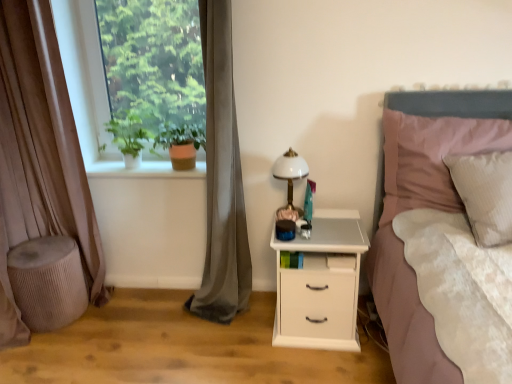
Measure the distance between green matte plant at upper left, the second plant positioned from the left, and camera.

They are 8.23 feet apart.

In order to face brown velvet curtain at left, the 2th curtain when ordered from right to left, should I rotate leftwards or rightwards?

It's best to rotate left around 26.371 degrees.

What do you see at coordinates (180, 143) in the screenshot? This screenshot has width=512, height=384. I see `green matte plant at upper left, positioned as the 2th plant in right-to-left order` at bounding box center [180, 143].

Where is `white glossy bedside lamp at center-right`? The height and width of the screenshot is (384, 512). white glossy bedside lamp at center-right is located at coordinates (290, 181).

Locate an element on the screen. Image resolution: width=512 pixels, height=384 pixels. nightstand below the brown velvet curtain at left, the 2th curtain when ordered from right to left (from the image's perspective) is located at coordinates (321, 284).

Consider the image. Does white matte nightstand at lower right have a lesser height compared to brown velvet curtain at left, which ranks as the 1th curtain in left-to-right order?

Correct, white matte nightstand at lower right is not as tall as brown velvet curtain at left, which ranks as the 1th curtain in left-to-right order.

Is white matte nightstand at lower right aimed at brown velvet curtain at left, the 2th curtain when ordered from right to left?

No, white matte nightstand at lower right does not turn towards brown velvet curtain at left, the 2th curtain when ordered from right to left.

Would you say white matte nightstand at lower right contains brown velvet curtain at left, which ranks as the 1th curtain in left-to-right order?

No, brown velvet curtain at left, which ranks as the 1th curtain in left-to-right order, is not a part of white matte nightstand at lower right.

Consider the image. From a real-world perspective, between green leafy plant at left and textured beige stool at lower left, who is vertically higher?

In real-world perspective, green leafy plant at left is above.

Consider the image. Which of these two, green leafy plant at left or textured beige stool at lower left, stands taller?

Standing taller between the two is green leafy plant at left.

Locate an element on the screen. This screenshot has width=512, height=384. window that appears on the right of textured beige stool at lower left is located at coordinates [x=140, y=63].

Between point (78, 11) and point (40, 318), which one is positioned in front?

Positioned in front is point (40, 318).

Measure the distance between white matte nightstand at lower right and smooth white surface at center left.

white matte nightstand at lower right is 92.68 centimeters away from smooth white surface at center left.

Looking at this image, which object is further away from the camera taking this photo, white matte nightstand at lower right or smooth white surface at center left?

smooth white surface at center left is further from the camera.

Between white matte nightstand at lower right and smooth white surface at center left, which one appears on the left side from the viewer's perspective?

From the viewer's perspective, smooth white surface at center left appears more on the left side.

Considering the positions of points (281, 250) and (120, 172), is point (281, 250) closer to camera compared to point (120, 172)?

Yes, point (281, 250) is closer to viewer.

Which object is more forward, green leafy plant at left or gray velvet curtain at left, the first curtain in the right-to-left sequence?

gray velvet curtain at left, the first curtain in the right-to-left sequence, is closer to the camera.

In the scene shown: Does green leafy plant at left appear on the right side of gray velvet curtain at left, positioned as the second curtain in left-to-right order?

No, green leafy plant at left is not to the right of gray velvet curtain at left, positioned as the second curtain in left-to-right order.

Is green leafy plant at left placed right next to gray velvet curtain at left, the first curtain in the right-to-left sequence?

No, green leafy plant at left is not beside gray velvet curtain at left, the first curtain in the right-to-left sequence.

Which of these two, green leafy plant at left or gray velvet curtain at left, the first curtain in the right-to-left sequence, is thinner?

Thinner between the two is green leafy plant at left.

Is green matte plant at upper left, positioned as the 2th plant in right-to-left order, far away from brown velvet curtain at left, which ranks as the 1th curtain in left-to-right order?

No, green matte plant at upper left, positioned as the 2th plant in right-to-left order, is not far from brown velvet curtain at left, which ranks as the 1th curtain in left-to-right order.

From the image's perspective, relative to brown velvet curtain at left, which ranks as the 1th curtain in left-to-right order, is green matte plant at upper left, positioned as the 1th plant in left-to-right order, above or below?

Clearly, from the image's perspective, green matte plant at upper left, positioned as the 1th plant in left-to-right order, is above brown velvet curtain at left, which ranks as the 1th curtain in left-to-right order.

Is point (125, 136) farther from camera compared to point (42, 230)?

No, it is in front of (42, 230).

Which of these two, green matte plant at upper left, positioned as the 1th plant in left-to-right order, or brown velvet curtain at left, which ranks as the 1th curtain in left-to-right order, is thinner?

With smaller width is brown velvet curtain at left, which ranks as the 1th curtain in left-to-right order.

From a real-world perspective, who is located lower, green leafy plant at left or white matte nightstand at lower right?

white matte nightstand at lower right.

Does point (146, 71) come behind point (282, 338)?

Yes, it is behind point (282, 338).

Is green leafy plant at left directly adjacent to white matte nightstand at lower right?

No, green leafy plant at left is not in contact with white matte nightstand at lower right.

Is green leafy plant at left turned away from white matte nightstand at lower right?

No.

From the image's perspective, between brown velvet curtain at left, which ranks as the 1th curtain in left-to-right order, and green leafy plant at left, which one is located above?

green leafy plant at left.

Is green leafy plant at left completely or partially inside brown velvet curtain at left, the 2th curtain when ordered from right to left?

No, brown velvet curtain at left, the 2th curtain when ordered from right to left, does not contain green leafy plant at left.

Between brown velvet curtain at left, the 2th curtain when ordered from right to left, and green leafy plant at left, which one is positioned behind?

green leafy plant at left.

Which of these two, brown velvet curtain at left, which ranks as the 1th curtain in left-to-right order, or green leafy plant at left, is thinner?

green leafy plant at left.

The width and height of the screenshot is (512, 384). What are the coordinates of `nightstand below the brown velvet curtain at left, the 2th curtain when ordered from right to left (from the image's perspective)` in the screenshot? It's located at (321, 284).

At what (x,y) coordinates should I click in order to perform the action: click on window on the right of textured beige stool at lower left. Please return your answer as a coordinate pair (x, y). Image resolution: width=512 pixels, height=384 pixels. Looking at the image, I should click on (140, 63).

Considering their positions, is gray velvet curtain at left, positioned as the second curtain in left-to-right order, positioned further to pink fabric pillow at right than green matte plant at upper left, the second plant positioned from the left?

green matte plant at upper left, the second plant positioned from the left.

Considering their positions, is textured beige stool at lower left positioned closer to white glossy bedside lamp at center-right than brown velvet curtain at left, which ranks as the 1th curtain in left-to-right order?

Among the two, brown velvet curtain at left, which ranks as the 1th curtain in left-to-right order, is located nearer to white glossy bedside lamp at center-right.

In the scene shown: Which object lies nearer to the anchor point green leafy plant at left, brown velvet curtain at left, the 2th curtain when ordered from right to left, or textured beige stool at lower left?

Based on the image, brown velvet curtain at left, the 2th curtain when ordered from right to left, appears to be nearer to green leafy plant at left.

Looking at the image, which one is located further to white matte nightstand at lower right, smooth white surface at center left or gray velvet curtain at left, the first curtain in the right-to-left sequence?

smooth white surface at center left is positioned further to the anchor white matte nightstand at lower right.

Considering their positions, is brown velvet curtain at left, the 2th curtain when ordered from right to left, positioned further to smooth white surface at center left than textured beige stool at lower left?

textured beige stool at lower left lies further to smooth white surface at center left than the other object.

Which object lies further to the anchor point gray velvet curtain at left, the first curtain in the right-to-left sequence, smooth white surface at center left or green leafy plant at left?

Among the two, green leafy plant at left is located further to gray velvet curtain at left, the first curtain in the right-to-left sequence.

In the scene shown: Looking at the image, which one is located closer to green matte plant at upper left, the second plant positioned from the left, textured beige stool at lower left or white matte nightstand at lower right?

textured beige stool at lower left is positioned closer to the anchor green matte plant at upper left, the second plant positioned from the left.

From the image, which object appears to be nearer to white matte nightstand at lower right, pink fabric pillow at right or green matte plant at upper left, the first plant in the right-to-left sequence?

pink fabric pillow at right.

Locate an element on the screen. bedside lamp between green leafy plant at left and white matte nightstand at lower right from top to bottom is located at coordinates (290, 181).

Identify the location of window sill situated between brown velvet curtain at left, the 2th curtain when ordered from right to left, and green matte plant at upper left, the first plant in the right-to-left sequence, from left to right. (144, 170).

You are a GUI agent. You are given a task and a screenshot of the screen. Output one action in this format:
    pyautogui.click(x=<x>, y=<y>)
    Task: Click on the window sill between green matte plant at upper left, positioned as the 1th plant in left-to-right order, and white matte nightstand at lower right
    
    Given the screenshot: What is the action you would take?
    click(144, 170)

Where is `window between brown velvet curtain at left, the 2th curtain when ordered from right to left, and gray velvet curtain at left, positioned as the second curtain in left-to-right order`? The width and height of the screenshot is (512, 384). window between brown velvet curtain at left, the 2th curtain when ordered from right to left, and gray velvet curtain at left, positioned as the second curtain in left-to-right order is located at coordinates (140, 63).